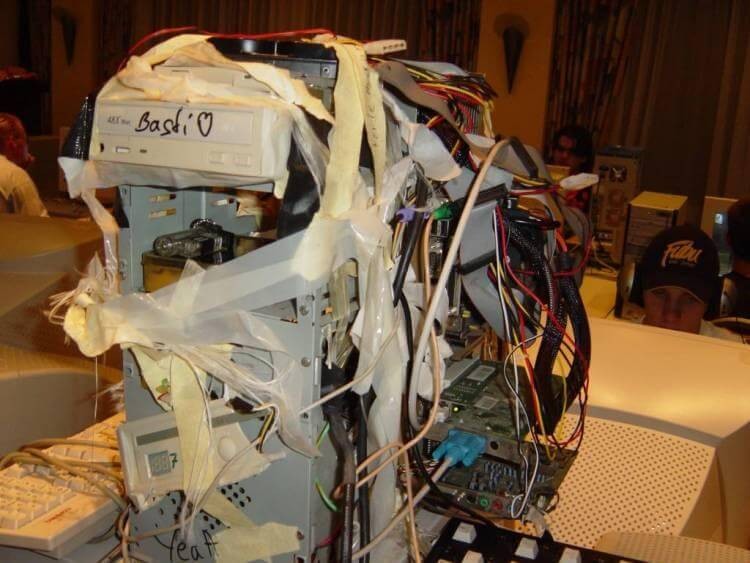
Where is `keyboard`? This screenshot has width=750, height=563. keyboard is located at coordinates (12, 497).